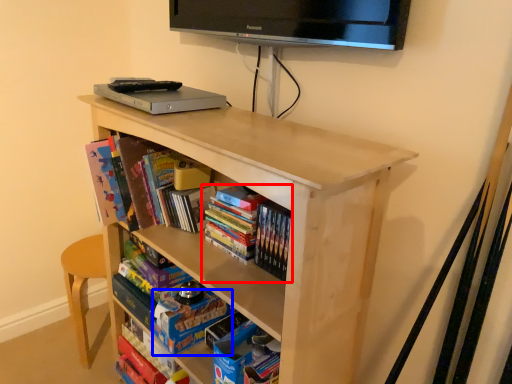
Question: Which object is further to the camera taking this photo, book (highlighted by a red box) or paperback book (highlighted by a blue box)?

Choices:
 (A) book
 (B) paperback book

Answer: (B)